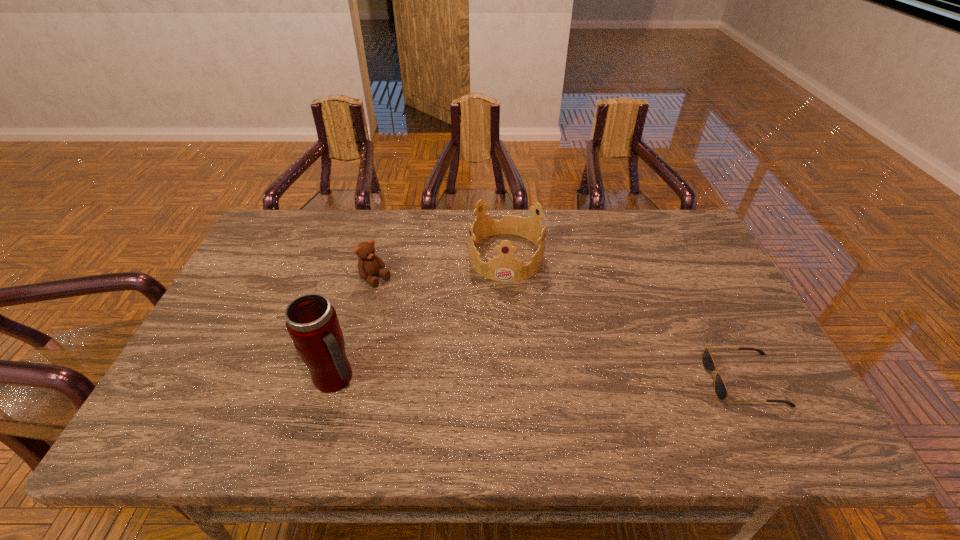
This screenshot has width=960, height=540. Find the location of `object present at the near right corner`. object present at the near right corner is located at coordinates (708, 363).

You are a GUI agent. You are given a task and a screenshot of the screen. Output one action in this format:
    pyautogui.click(x=<x>, y=<y>)
    Task: Click on the free spot at the far edge of the desktop
    This screenshot has height=540, width=960.
    Given the screenshot: What is the action you would take?
    pyautogui.click(x=476, y=249)

In the image, there is a desktop. Identify the location of free space at the near edge. (583, 386).

Locate an element on the screen. The height and width of the screenshot is (540, 960). vacant area at the left edge is located at coordinates click(x=282, y=254).

Where is `vacant space at the right edge`? vacant space at the right edge is located at coordinates (728, 329).

The height and width of the screenshot is (540, 960). Find the location of `vacant region at the far left corner of the desktop`. vacant region at the far left corner of the desktop is located at coordinates (309, 225).

This screenshot has width=960, height=540. I want to click on vacant region at the far right corner of the desktop, so click(x=650, y=232).

I want to click on vacant point located between the second tallest object and the teddy bear, so click(441, 268).

At what (x,y) coordinates should I click in order to perform the action: click on vacant space that is in between the sunglasses and the tallest object. Please return your answer as a coordinate pair (x, y). Looking at the image, I should click on click(540, 379).

Where is `vacant area between the second object from right to left and the shortest object`? vacant area between the second object from right to left and the shortest object is located at coordinates (625, 318).